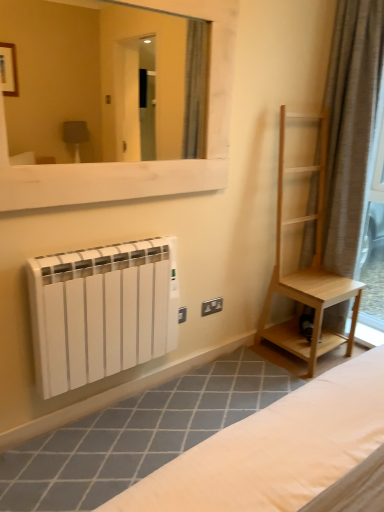
Question: Is black plastic electric outlet at lower center a part of white matte radiator at lower left?

Choices:
 (A) no
 (B) yes

Answer: (A)

Question: From the image's perspective, does white matte radiator at lower left appear lower than black plastic electric outlet at lower center?

Choices:
 (A) yes
 (B) no

Answer: (A)

Question: Does white matte radiator at lower left appear on the left side of black plastic electric outlet at lower center?

Choices:
 (A) no
 (B) yes

Answer: (A)

Question: Is white matte radiator at lower left looking in the opposite direction of black plastic electric outlet at lower center?

Choices:
 (A) no
 (B) yes

Answer: (A)

Question: Is white matte radiator at lower left positioned beyond the bounds of black plastic electric outlet at lower center?

Choices:
 (A) yes
 (B) no

Answer: (A)

Question: From a real-world perspective, is white matte radiator at lower left located higher than black plastic electric outlet at lower center?

Choices:
 (A) no
 (B) yes

Answer: (A)

Question: From the image's perspective, is brown textured curtain at right over white wooden mirror at upper center?

Choices:
 (A) yes
 (B) no

Answer: (B)

Question: Does brown textured curtain at right have a greater width compared to white wooden mirror at upper center?

Choices:
 (A) no
 (B) yes

Answer: (B)

Question: Is brown textured curtain at right touching white wooden mirror at upper center?

Choices:
 (A) yes
 (B) no

Answer: (B)

Question: Considering the relative sizes of brown textured curtain at right and white wooden mirror at upper center in the image provided, is brown textured curtain at right shorter than white wooden mirror at upper center?

Choices:
 (A) no
 (B) yes

Answer: (A)

Question: Can you confirm if brown textured curtain at right is bigger than white wooden mirror at upper center?

Choices:
 (A) yes
 (B) no

Answer: (A)

Question: Would you consider brown textured curtain at right to be distant from white wooden mirror at upper center?

Choices:
 (A) no
 (B) yes

Answer: (B)

Question: Would you say white matte radiator at lower left is a long distance from white wooden mirror at upper center?

Choices:
 (A) yes
 (B) no

Answer: (A)